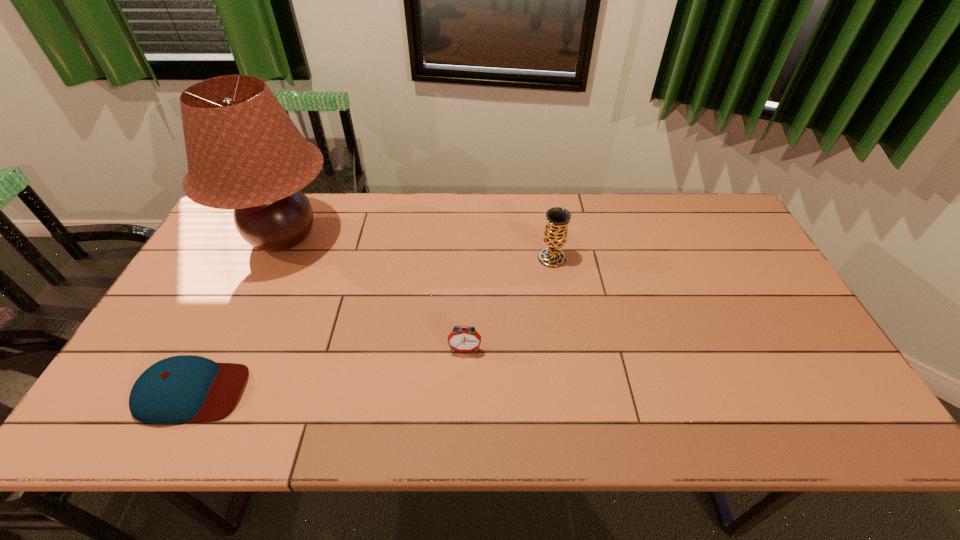
Identify the location of free space located with the bill of the baseball cap facing forward. The width and height of the screenshot is (960, 540). (283, 392).

You are a GUI agent. You are given a task and a screenshot of the screen. Output one action in this format:
    pyautogui.click(x=<x>, y=<y>)
    Task: Click on the object that is at the far edge
    Image resolution: width=960 pixels, height=540 pixels.
    Given the screenshot: What is the action you would take?
    pyautogui.click(x=244, y=152)

Identify the location of object that is at the near edge. The height and width of the screenshot is (540, 960). (186, 388).

Locate an element on the screen. The height and width of the screenshot is (540, 960). lampshade that is at the left edge is located at coordinates (244, 152).

The width and height of the screenshot is (960, 540). Find the location of `baseball cap that is at the left edge`. baseball cap that is at the left edge is located at coordinates click(186, 388).

You are a GUI agent. You are given a task and a screenshot of the screen. Output one action in this format:
    pyautogui.click(x=<x>, y=<y>)
    Task: Click on the object at the far left corner
    
    Given the screenshot: What is the action you would take?
    pyautogui.click(x=244, y=152)

The width and height of the screenshot is (960, 540). Identify the location of object present at the near left corner. (186, 388).

Where is `free space at the far edge of the desktop`? This screenshot has height=540, width=960. free space at the far edge of the desktop is located at coordinates (381, 210).

You are a GUI agent. You are given a task and a screenshot of the screen. Output one action in this format:
    pyautogui.click(x=<x>, y=<y>)
    Task: Click on the vacant space at the near edge of the desktop
    
    Given the screenshot: What is the action you would take?
    pyautogui.click(x=297, y=414)

Where is `blank space at the left edge of the desktop`? blank space at the left edge of the desktop is located at coordinates (186, 298).